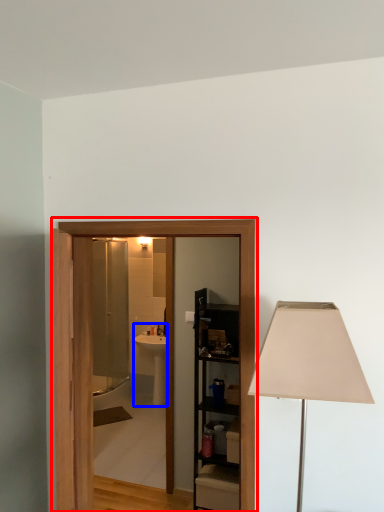
Question: Which object appears farthest to the camera in this image, barn door (highlighted by a red box) or sink (highlighted by a blue box)?

Choices:
 (A) barn door
 (B) sink

Answer: (B)